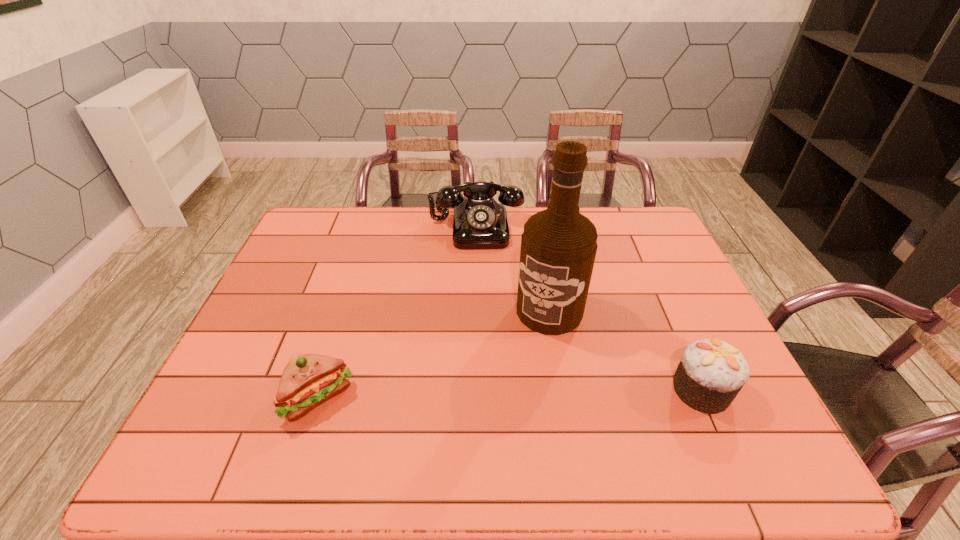
Locate an element on the screen. This screenshot has width=960, height=540. the leftmost object is located at coordinates (308, 380).

You are a GUI agent. You are given a task and a screenshot of the screen. Output one action in this format:
    pyautogui.click(x=<x>, y=<y>)
    Task: Click on the rightmost object
    
    Given the screenshot: What is the action you would take?
    pyautogui.click(x=711, y=373)

At what (x,y) coordinates should I click in order to perform the action: click on the second farthest object. Please return your answer as a coordinate pair (x, y). Looking at the image, I should click on (558, 246).

Locate an element on the screen. the tallest object is located at coordinates (558, 246).

You are a GUI agent. You are given a task and a screenshot of the screen. Output one action in this format:
    pyautogui.click(x=<x>, y=<y>)
    Task: Click on the telephone
    The image size is (960, 540).
    Given the screenshot: What is the action you would take?
    pyautogui.click(x=479, y=222)

You are a GUI agent. You are given a task and a screenshot of the screen. Output one action in this format:
    pyautogui.click(x=<x>, y=<y>)
    Task: Click on the free space located on the left of the leftmost object
    
    Given the screenshot: What is the action you would take?
    pyautogui.click(x=220, y=399)

This screenshot has width=960, height=540. What are the coordinates of `vacant space positioned 0.380m on the back of the cupcake` in the screenshot? It's located at (647, 268).

Where is `blank space located on the label of the second farthest object`? blank space located on the label of the second farthest object is located at coordinates (519, 366).

Image resolution: width=960 pixels, height=540 pixels. Identify the location of free space located 0.200m on the label of the second farthest object. (506, 390).

The width and height of the screenshot is (960, 540). In order to click on free location located on the label of the second farthest object in this screenshot , I will do `click(494, 410)`.